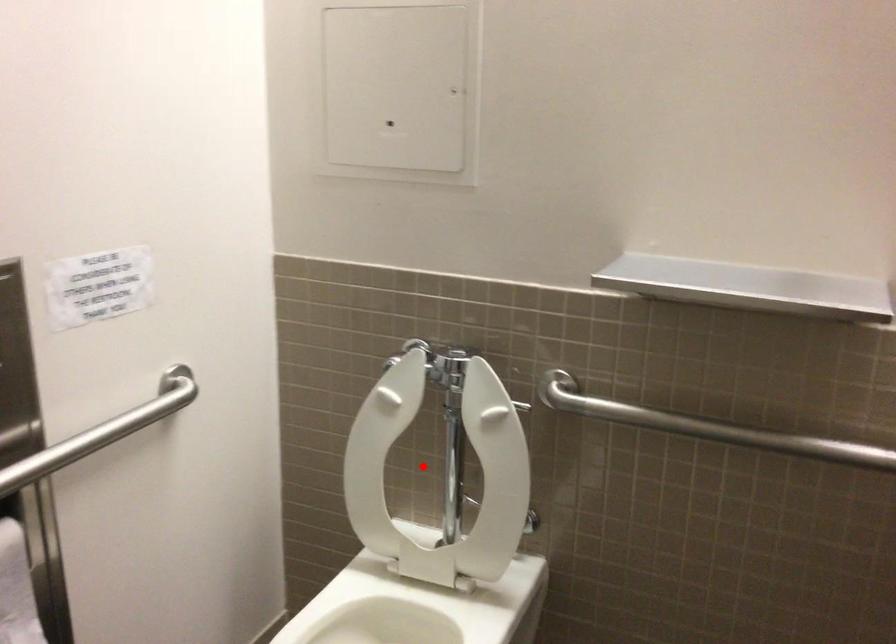
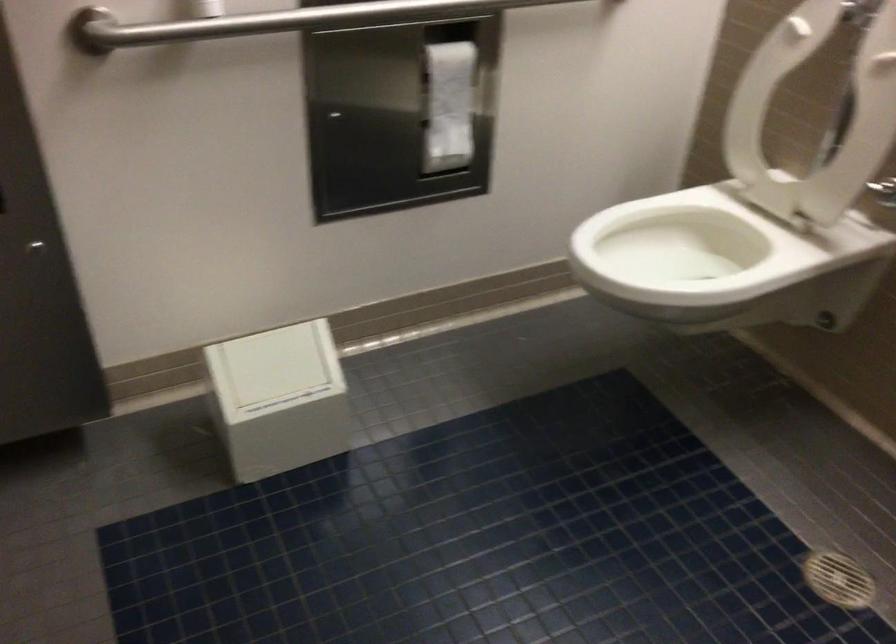
Find the pixel in the second image that matches the highlighted location in the first image.

(814, 115)